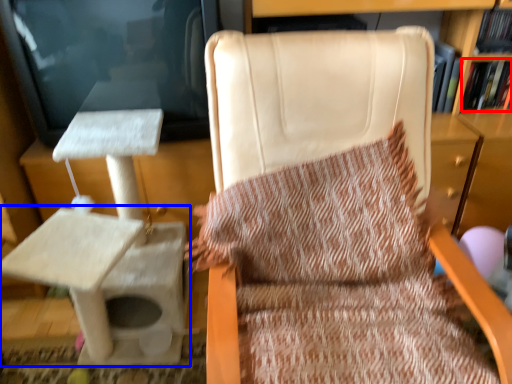
Question: Which point is closer to the camera, book (highlighted by a red box) or table (highlighted by a blue box)?

Choices:
 (A) book
 (B) table

Answer: (B)